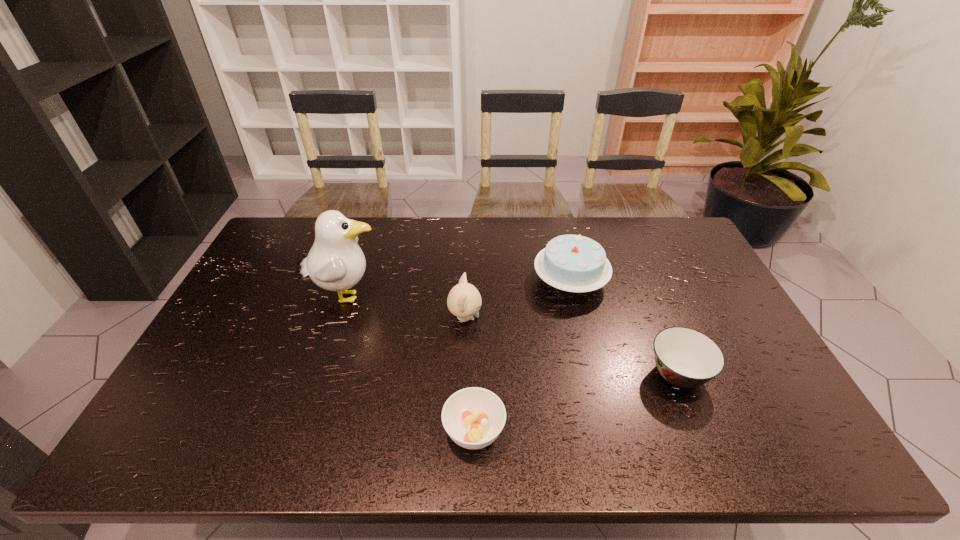
Find the location of a particular element. The width and height of the screenshot is (960, 540). the tallest object is located at coordinates click(335, 262).

Image resolution: width=960 pixels, height=540 pixels. Find the location of `gull`. gull is located at coordinates (335, 262).

This screenshot has width=960, height=540. Find the location of `birthday cake`. birthday cake is located at coordinates (574, 263).

Image resolution: width=960 pixels, height=540 pixels. What are the coordinates of `kitten` in the screenshot? It's located at (464, 300).

What are the coordinates of `the fourth tallest object` in the screenshot? It's located at (687, 358).

Where is `the farther soup bowl`? The image size is (960, 540). the farther soup bowl is located at coordinates (687, 358).

Locate an element on the screen. The width and height of the screenshot is (960, 540). the nearest object is located at coordinates (473, 417).

The image size is (960, 540). What are the coordinates of `the nearer soup bowl` in the screenshot? It's located at (473, 417).

Where is `vacant region located on the beak of the gull`? vacant region located on the beak of the gull is located at coordinates (438, 296).

Identify the location of free space located on the back of the birthday cake. The height and width of the screenshot is (540, 960). (559, 232).